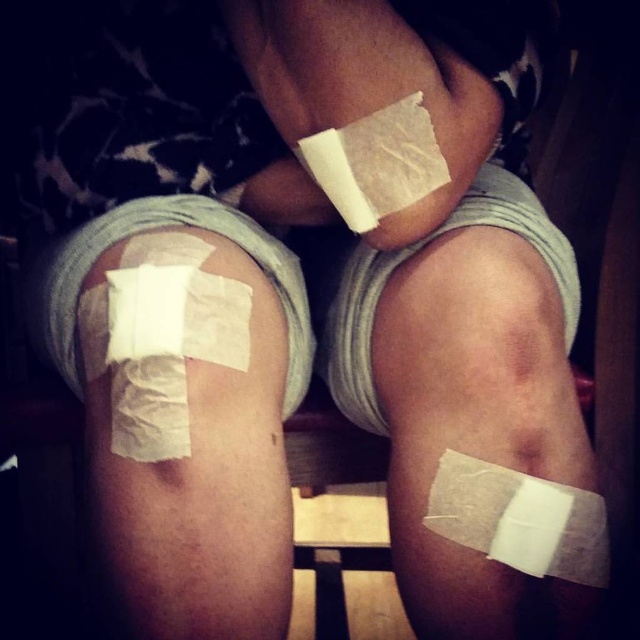
Question: Is white matte bandage at center to the right of white matte bandage at lower left from the viewer's perspective?

Choices:
 (A) yes
 (B) no

Answer: (A)

Question: Is white matte bandage at upper center positioned in front of white matte bandage at lower right?

Choices:
 (A) no
 (B) yes

Answer: (B)

Question: Which of these objects is positioned closest to the white matte bandage at upper center?

Choices:
 (A) white matte bandage at lower left
 (B) white matte bandage at lower right
 (C) white matte bandage at center

Answer: (C)

Question: Among these points, which one is farthest from the camera?

Choices:
 (A) (573, 493)
 (B) (104, 452)
 (C) (310, 202)

Answer: (C)

Question: Can you confirm if white matte bandage at upper center is positioned to the left of white matte bandage at lower right?

Choices:
 (A) no
 (B) yes

Answer: (B)

Question: Which object is farther from the camera taking this photo?

Choices:
 (A) white matte bandage at lower left
 (B) white matte bandage at upper center
 (C) white matte bandage at lower right
 (D) white matte bandage at center

Answer: (D)